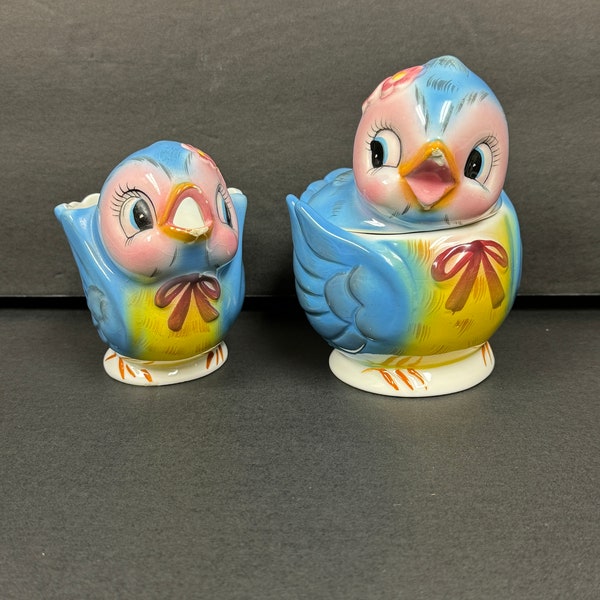
At what (x,y) coordinates should I click in order to perform the action: click on table. Please return your answer as a coordinate pair (x, y). The height and width of the screenshot is (600, 600). Looking at the image, I should click on (257, 501).